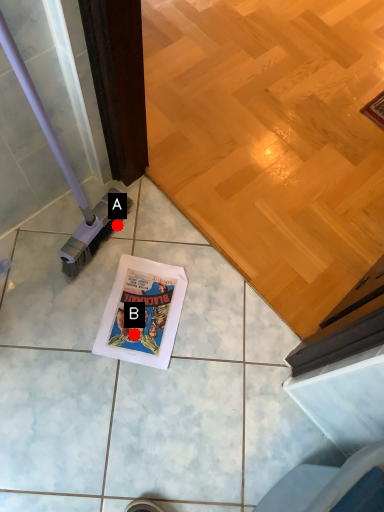
Question: Two points are circled on the image, labeled by A and B beside each circle. Which point is closer to the camera taking this photo?

Choices:
 (A) A is closer
 (B) B is closer

Answer: (B)